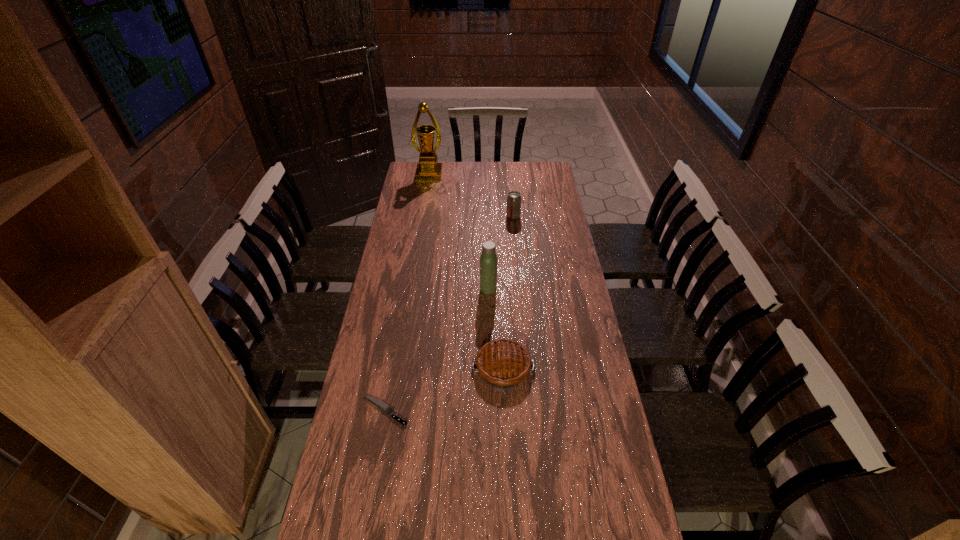
Find the location of a particular element. vacant space located 0.120m on the front-facing side of the tallest object is located at coordinates point(426,193).

The width and height of the screenshot is (960, 540). Find the location of `free region located on the back of the third nearest object`. free region located on the back of the third nearest object is located at coordinates (488, 240).

Where is `vacant space situated on the left of the soda can`? This screenshot has height=540, width=960. vacant space situated on the left of the soda can is located at coordinates (489, 217).

Where is `vacant area situated 0.210m on the right of the second shortest object`? vacant area situated 0.210m on the right of the second shortest object is located at coordinates (599, 368).

Find the location of a particular element. Image resolution: width=960 pixels, height=540 pixels. vacant space positioned on the front of the steak knife is located at coordinates (378, 446).

I want to click on object present at the far edge, so click(x=428, y=169).

The width and height of the screenshot is (960, 540). Identify the location of award present at the left edge. (428, 169).

The image size is (960, 540). I want to click on steak knife situated at the left edge, so click(x=384, y=407).

You are a GUI agent. You are given a task and a screenshot of the screen. Output one action in this format:
    pyautogui.click(x=<x>, y=<y>)
    Task: Click on the object positioned at the far left corner
    The image size is (960, 540).
    Given the screenshot: What is the action you would take?
    pyautogui.click(x=428, y=169)

In the image, there is a desktop. At what (x,y) coordinates should I click in order to perform the action: click on free region at the far edge. Please return your answer as a coordinate pair (x, y). Image resolution: width=960 pixels, height=540 pixels. Looking at the image, I should click on (514, 177).